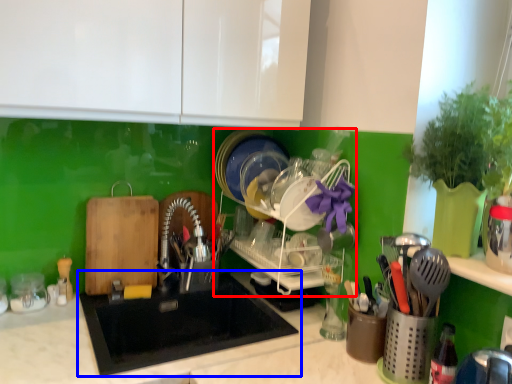
Question: Which object appears farthest to the camera in this image, dish washer (highlighted by a red box) or sink (highlighted by a blue box)?

Choices:
 (A) dish washer
 (B) sink

Answer: (A)